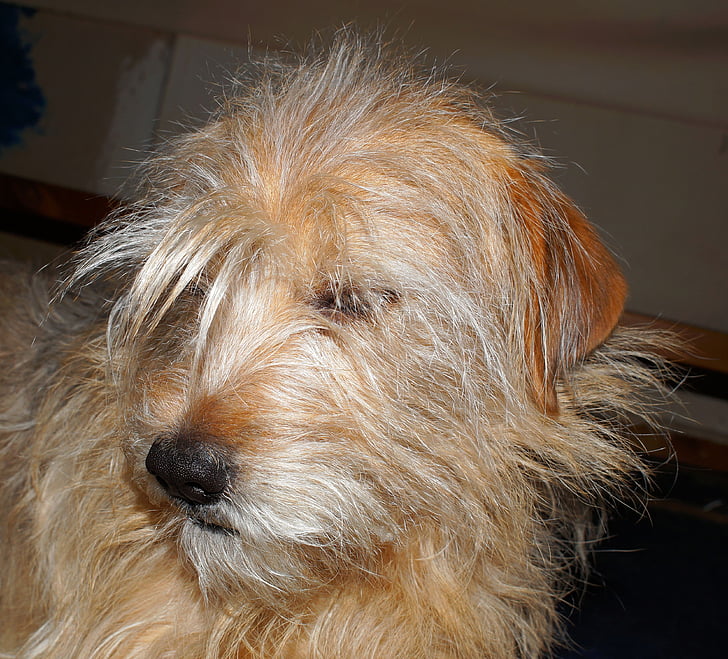
You are a GUI agent. You are given a task and a screenshot of the screen. Output one action in this format:
    pyautogui.click(x=<x>, y=<y>)
    Task: Click on the wall
    The height and width of the screenshot is (659, 728).
    Given the screenshot: What is the action you would take?
    pyautogui.click(x=92, y=109)